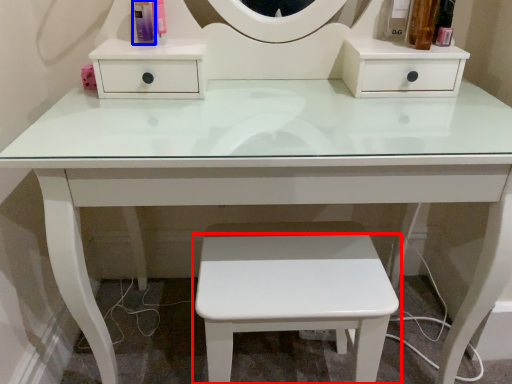
Question: Which point is further to the camera, stool (highlighted by a red box) or toiletry (highlighted by a blue box)?

Choices:
 (A) stool
 (B) toiletry

Answer: (B)